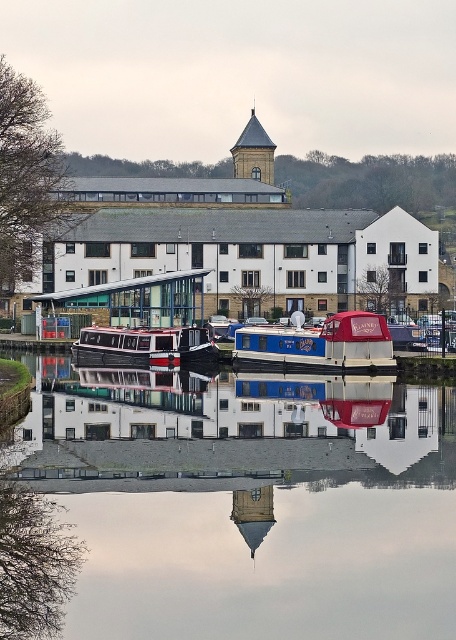
Question: Where is transparent glass water at center located in relation to blue painted wooden canal boat at center in the image?

Choices:
 (A) below
 (B) above

Answer: (A)

Question: Can you confirm if metallic glass dock at center is bigger than blue polished wood boat at center?

Choices:
 (A) no
 (B) yes

Answer: (B)

Question: Which of the following is the farthest from the observer?

Choices:
 (A) blue painted wooden canal boat at center
 (B) smooth glass tower at center
 (C) transparent glass water at center
 (D) metallic glass dock at center

Answer: (D)

Question: Is metallic glass dock at center to the right of blue polished wood boat at center from the viewer's perspective?

Choices:
 (A) no
 (B) yes

Answer: (A)

Question: Which of the following is the closest to the observer?

Choices:
 (A) blue painted wooden canal boat at center
 (B) smooth glass tower at center

Answer: (B)

Question: Among these objects, which one is farthest from the camera?

Choices:
 (A) smooth glass tower at center
 (B) transparent glass water at center
 (C) blue painted wooden canal boat at center

Answer: (C)